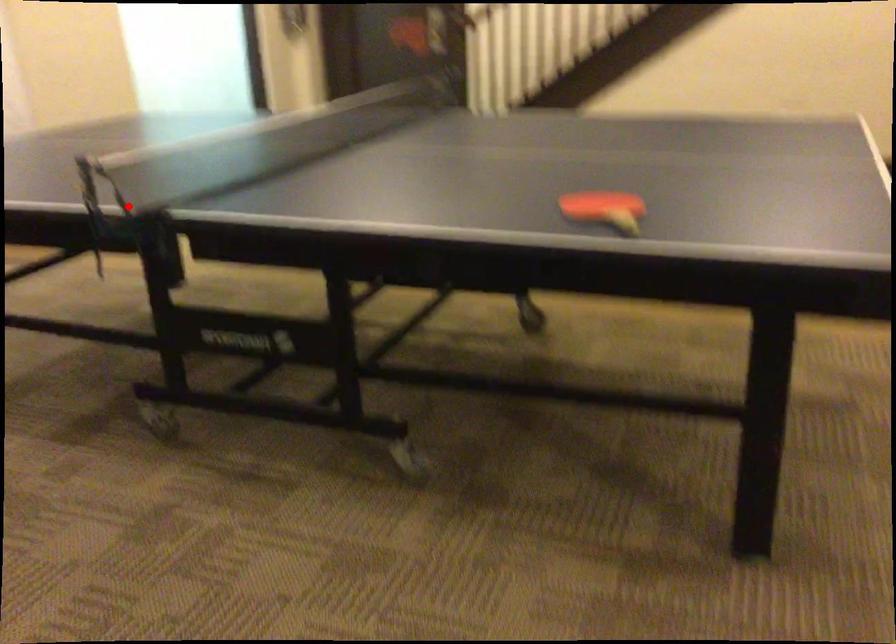
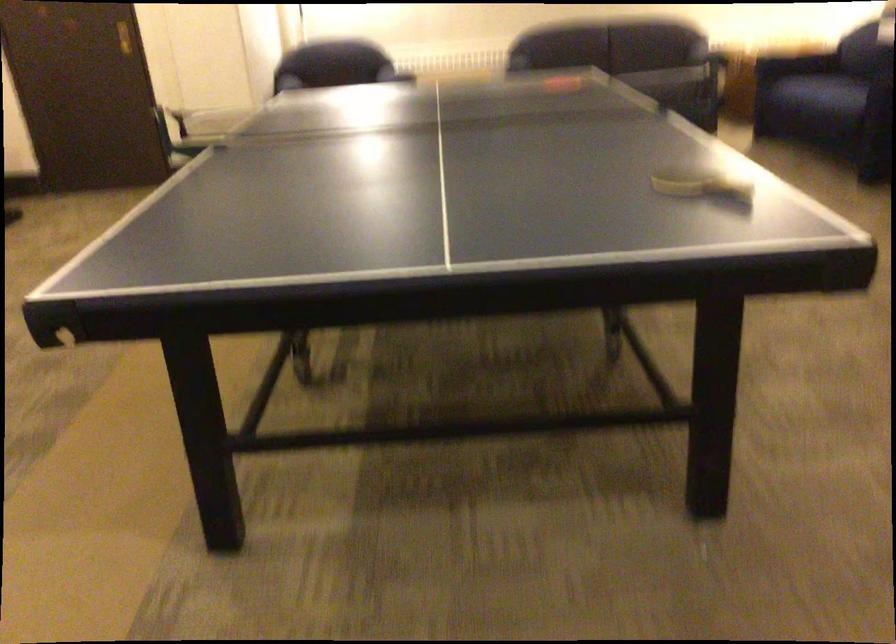
Question: I am providing you with two images of the same scene from different viewpoints. A red point is shown in image1. For the corresponding object point in image2, is it positioned nearer or farther from the camera?

Choices:
 (A) Nearer
 (B) Farther

Answer: (B)